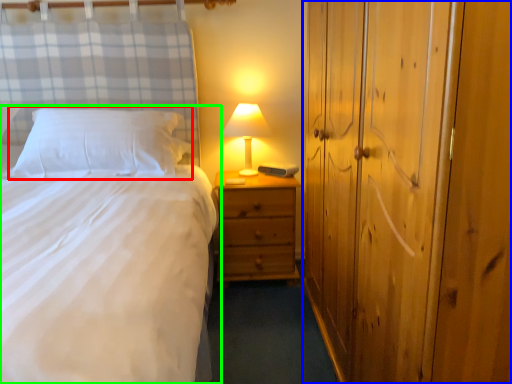
Question: Considering the real-world distances, which object is closest to pillow (highlighted by a red box)? dresser (highlighted by a blue box) or bed (highlighted by a green box).

Choices:
 (A) dresser
 (B) bed

Answer: (B)